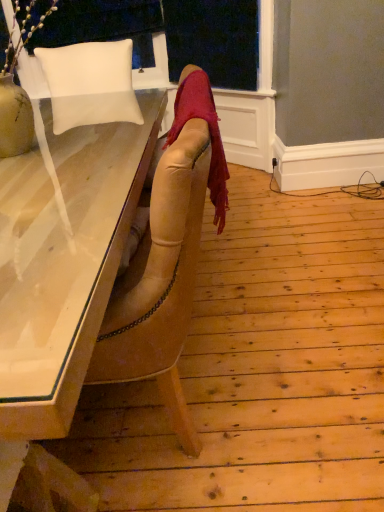
I want to click on white matte pillow at upper left, so click(90, 84).

What do you see at coordinates (61, 276) in the screenshot? The width and height of the screenshot is (384, 512). I see `matte wooden desk at left` at bounding box center [61, 276].

The height and width of the screenshot is (512, 384). I want to click on matte wooden desk at left, so click(61, 276).

Locate an element on the screen. white matte pillow at upper left is located at coordinates (90, 84).

Which object is thinner, white leather chair at upper left or velvet red scarf at center?

white leather chair at upper left is thinner.

From the image's perspective, does white leather chair at upper left appear lower than velvet red scarf at center?

No, from the image's perspective, white leather chair at upper left is not below velvet red scarf at center.

Can you tell me how much white leather chair at upper left and velvet red scarf at center differ in facing direction?

The facing directions of white leather chair at upper left and velvet red scarf at center are 92 degrees apart.

Visually, is white leather chair at upper left positioned to the left or to the right of velvet red scarf at center?

white leather chair at upper left is positioned on velvet red scarf at center's left side.

Which is more to the right, velvet red scarf at center or matte wooden desk at left?

velvet red scarf at center is more to the right.

This screenshot has height=512, width=384. Identify the location of desk lying on the left of velvet red scarf at center. (61, 276).

Considering the sizes of objects velvet red scarf at center and matte wooden desk at left in the image provided, who is taller, velvet red scarf at center or matte wooden desk at left?

matte wooden desk at left.

From the image's perspective, who appears lower, velvet red scarf at center or matte wooden desk at left?

matte wooden desk at left.

Does white matte pillow at upper left have a smaller size compared to matte wooden desk at left?

Yes, white matte pillow at upper left is smaller than matte wooden desk at left.

Would you say white matte pillow at upper left is a long distance from matte wooden desk at left?

No, there isn't a large distance between white matte pillow at upper left and matte wooden desk at left.

Can we say white matte pillow at upper left lies outside matte wooden desk at left?

white matte pillow at upper left is positioned outside matte wooden desk at left.

In the image, is velvet red scarf at center positioned in front of or behind white leather chair at upper left?

In the image, velvet red scarf at center appears in front of white leather chair at upper left.

Is velvet red scarf at center touching white leather chair at upper left?

velvet red scarf at center and white leather chair at upper left are clearly separated.

Is velvet red scarf at center positioned with its back to white leather chair at upper left?

velvet red scarf at center does not have its back to white leather chair at upper left.

From the picture: From a real-world perspective, which is physically below, velvet red scarf at center or white leather chair at upper left?

A: velvet red scarf at center.

Do you think white leather chair at upper left is within matte wooden desk at left, or outside of it?

The correct answer is: outside.

Does white leather chair at upper left turn towards matte wooden desk at left?

Yes, white leather chair at upper left is oriented towards matte wooden desk at left.

Between white leather chair at upper left and matte wooden desk at left, which one has smaller size?

Smaller between the two is white leather chair at upper left.

From their relative heights in the image, would you say white leather chair at upper left is taller or shorter than matte wooden desk at left?

Clearly, white leather chair at upper left is shorter compared to matte wooden desk at left.

Would you say white matte pillow at upper left is outside velvet red scarf at center?

Indeed, white matte pillow at upper left is completely outside velvet red scarf at center.

Which of these two, white matte pillow at upper left or velvet red scarf at center, stands shorter?

velvet red scarf at center.

The image size is (384, 512). I want to click on pillow behind the velvet red scarf at center, so click(90, 84).

Is velvet red scarf at center at the back of white matte pillow at upper left?

white matte pillow at upper left is not turned away from velvet red scarf at center.

Is point (70, 39) closer or farther from the camera than point (69, 98)?

Clearly, point (70, 39) is more distant from the camera than point (69, 98).

Considering the relative sizes of white leather chair at upper left and white matte pillow at upper left in the image provided, is white leather chair at upper left smaller than white matte pillow at upper left?

Yes.

Can you tell me how much white leather chair at upper left and white matte pillow at upper left differ in facing direction?

The facing directions of white leather chair at upper left and white matte pillow at upper left are 0.402 degrees apart.

Looking at this image, is white leather chair at upper left aimed at white matte pillow at upper left?

Yes, white leather chair at upper left is oriented towards white matte pillow at upper left.

Identify the location of blanket below the white leather chair at upper left (from the image's perspective). (209, 135).

Find the location of a particular element. blanket behind the matte wooden desk at left is located at coordinates (209, 135).

From the image, which object appears to be farther from velvet red scarf at center, white matte pillow at upper left or white leather chair at upper left?

white leather chair at upper left is further to velvet red scarf at center.

Which object lies nearer to the anchor point white matte pillow at upper left, white leather chair at upper left or velvet red scarf at center?

Among the two, white leather chair at upper left is located nearer to white matte pillow at upper left.

Which object lies nearer to the anchor point white leather chair at upper left, white matte pillow at upper left or matte wooden desk at left?

white matte pillow at upper left is positioned closer to the anchor white leather chair at upper left.

When comparing their distances from white leather chair at upper left, does velvet red scarf at center or white matte pillow at upper left seem closer?

The object closer to white leather chair at upper left is white matte pillow at upper left.

Considering their positions, is white leather chair at upper left positioned further to white matte pillow at upper left than matte wooden desk at left?

white leather chair at upper left.

In the scene shown: Estimate the real-world distances between objects in this image. Which object is further from white matte pillow at upper left, velvet red scarf at center or white leather chair at upper left?

velvet red scarf at center.

From the picture: Estimate the real-world distances between objects in this image. Which object is further from white leather chair at upper left, white matte pillow at upper left or velvet red scarf at center?

Among the two, velvet red scarf at center is located further to white leather chair at upper left.

When comparing their distances from velvet red scarf at center, does white leather chair at upper left or matte wooden desk at left seem further?

Based on the image, white leather chair at upper left appears to be further to velvet red scarf at center.

Where is `pillow between velvet red scarf at center and white leather chair at upper left in the front-back direction`? This screenshot has width=384, height=512. pillow between velvet red scarf at center and white leather chair at upper left in the front-back direction is located at coordinates (90, 84).

At what (x,y) coordinates should I click in order to perform the action: click on blanket between matte wooden desk at left and white leather chair at upper left from front to back. Please return your answer as a coordinate pair (x, y). Looking at the image, I should click on [x=209, y=135].

In order to click on blanket between matte wooden desk at left and white matte pillow at upper left from front to back in this screenshot , I will do `click(209, 135)`.

Identify the location of pillow between matte wooden desk at left and white leather chair at upper left from front to back. The width and height of the screenshot is (384, 512). (90, 84).